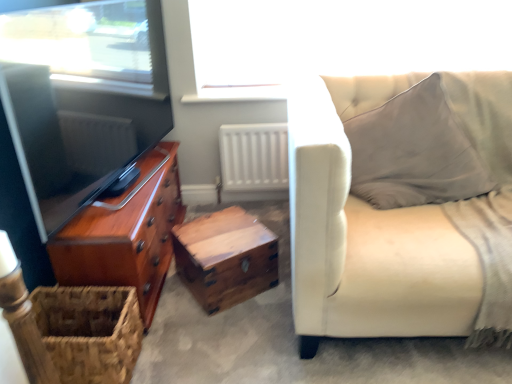
Question: Can you confirm if transparent glass window at upper center is positioned to the right of wooden trunk at center?

Choices:
 (A) no
 (B) yes

Answer: (B)

Question: Considering the relative positions of transparent glass window at upper center and wooden trunk at center in the image provided, is transparent glass window at upper center to the left of wooden trunk at center from the viewer's perspective?

Choices:
 (A) no
 (B) yes

Answer: (A)

Question: Is wooden trunk at center surrounded by transparent glass window at upper center?

Choices:
 (A) no
 (B) yes

Answer: (A)

Question: From a real-world perspective, is transparent glass window at upper center located higher than wooden trunk at center?

Choices:
 (A) no
 (B) yes

Answer: (B)

Question: Could you tell me if transparent glass window at upper center is turned towards wooden trunk at center?

Choices:
 (A) no
 (B) yes

Answer: (A)

Question: Is transparent glass window at upper center oriented away from wooden trunk at center?

Choices:
 (A) no
 (B) yes

Answer: (A)

Question: Can you confirm if transparent glass window at upper center is taller than white matte radiator at center?

Choices:
 (A) yes
 (B) no

Answer: (B)

Question: Considering the relative sizes of transparent glass window at upper center and white matte radiator at center in the image provided, is transparent glass window at upper center smaller than white matte radiator at center?

Choices:
 (A) no
 (B) yes

Answer: (A)

Question: Is transparent glass window at upper center at the right side of white matte radiator at center?

Choices:
 (A) no
 (B) yes

Answer: (B)

Question: Is transparent glass window at upper center positioned far away from white matte radiator at center?

Choices:
 (A) yes
 (B) no

Answer: (B)

Question: Can you confirm if transparent glass window at upper center is thinner than white matte radiator at center?

Choices:
 (A) no
 (B) yes

Answer: (B)

Question: Is transparent glass window at upper center surrounding white matte radiator at center?

Choices:
 (A) no
 (B) yes

Answer: (A)

Question: From the image's perspective, would you say white matte radiator at center is shown under light beige fabric couch at right?

Choices:
 (A) no
 (B) yes

Answer: (A)